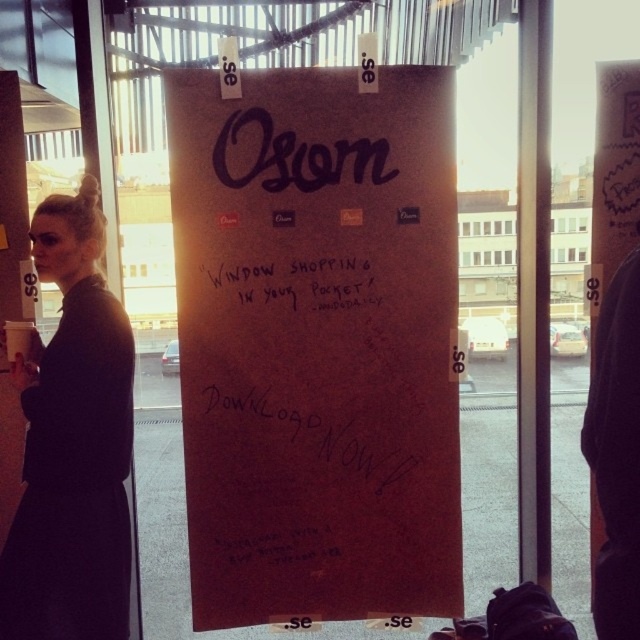
Question: Which object is the closest to the brown corkboard at center?

Choices:
 (A) dark gray coat at left
 (B) black paper at center

Answer: (B)

Question: Does dark gray coat at left have a smaller size compared to black paper at center?

Choices:
 (A) no
 (B) yes

Answer: (A)

Question: Among these objects, which one is farthest from the camera?

Choices:
 (A) black paper at center
 (B) dark gray coat at left
 (C) brown corkboard at center

Answer: (A)

Question: Is brown corkboard at center wider than black paper at center?

Choices:
 (A) yes
 (B) no

Answer: (A)

Question: Which point is closer to the camera?

Choices:
 (A) (616, 557)
 (B) (99, 598)
 (C) (310, 196)
 (D) (259, 288)

Answer: (A)

Question: Is brown corkboard at center above dark gray coat at left?

Choices:
 (A) no
 (B) yes

Answer: (B)